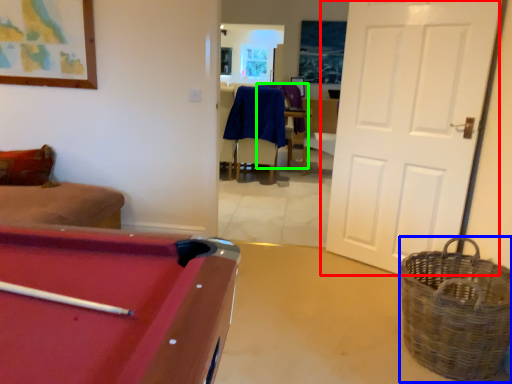
Question: Which object is positioned closest to door (highlighted by a red box)? Select from basket (highlighted by a blue box) and armchair (highlighted by a green box).

Choices:
 (A) basket
 (B) armchair

Answer: (A)